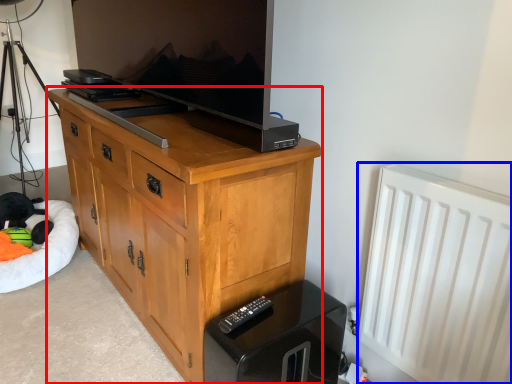
Question: Which object appears farthest to the camera in this image, chest of drawers (highlighted by a red box) or radiator (highlighted by a blue box)?

Choices:
 (A) chest of drawers
 (B) radiator

Answer: (A)